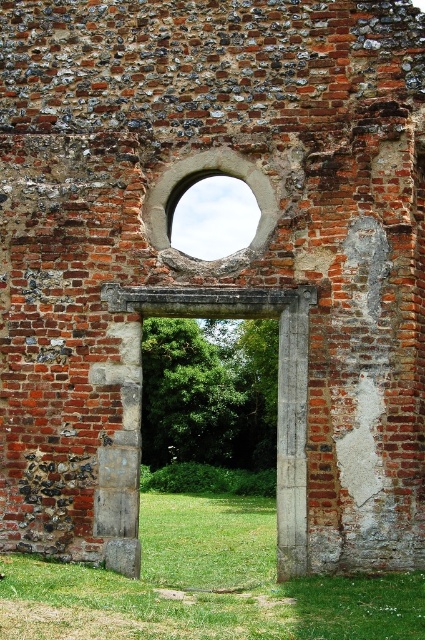
Question: Where is green grass at lower center located in relation to smooth stone archway at center in the image?

Choices:
 (A) below
 (B) above

Answer: (A)

Question: Which point is closer to the camera?

Choices:
 (A) click(x=203, y=621)
 (B) click(x=266, y=240)

Answer: (A)

Question: Which object is closer to the camera taking this photo?

Choices:
 (A) smooth stone archway at center
 (B) green grass at lower center

Answer: (B)

Question: Can you confirm if green grass at lower center is positioned to the left of smooth stone archway at center?

Choices:
 (A) yes
 (B) no

Answer: (A)

Question: Does green grass at lower center appear over smooth stone archway at center?

Choices:
 (A) yes
 (B) no

Answer: (B)